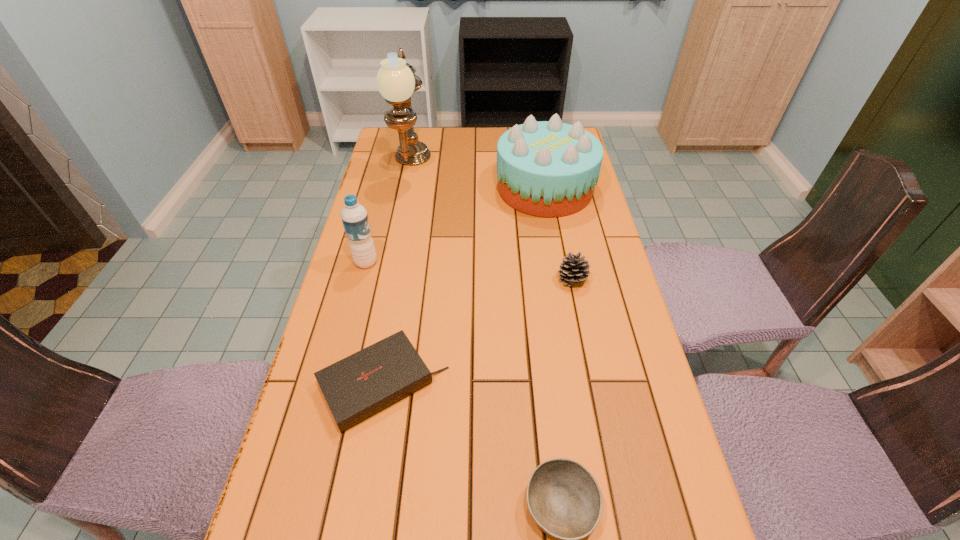
You are a GUI agent. You are given a task and a screenshot of the screen. Output one action in this format:
    pyautogui.click(x=<x>, y=<y>)
    Task: Click on the free space at the right edge of the desktop
    This screenshot has height=540, width=960.
    Given the screenshot: What is the action you would take?
    pyautogui.click(x=601, y=252)

Where is `vacant point located between the shortest object and the tallest object`? vacant point located between the shortest object and the tallest object is located at coordinates (397, 275).

This screenshot has width=960, height=540. Find the location of `vacant space that is in between the water bottle and the cake`. vacant space that is in between the water bottle and the cake is located at coordinates pyautogui.click(x=455, y=226).

Where is `empty space that is in between the cake and the shortest object`? This screenshot has height=540, width=960. empty space that is in between the cake and the shortest object is located at coordinates (464, 286).

I want to click on free spot between the oil lamp and the fifth farthest object, so click(x=397, y=275).

You are a GUI agent. You are given a task and a screenshot of the screen. Output one action in this format:
    pyautogui.click(x=<x>, y=<y>)
    Task: Click on the object that is the second closest one to the oil lamp
    Image resolution: width=960 pixels, height=540 pixels.
    Given the screenshot: What is the action you would take?
    pyautogui.click(x=354, y=216)

Locate an element on the screen. The height and width of the screenshot is (540, 960). the fifth closest object to the water bottle is located at coordinates (564, 499).

Locate an element on the screen. vacant position in the image that satisfies the following two spatial constraints: 1. on the front side of the tallest object; 2. on the label of the water bottle is located at coordinates (392, 262).

Locate an element on the screen. free space that satisfies the following two spatial constraints: 1. on the front side of the fifth farthest object; 2. on the left side of the tallest object is located at coordinates (368, 384).